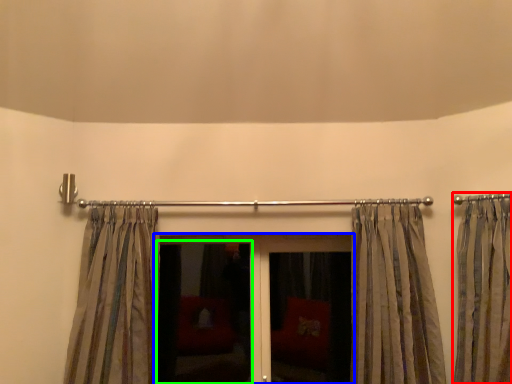
Question: Considering the real-world distances, which object is farthest from curtain (highlighted by a red box)? door (highlighted by a blue box) or screen door (highlighted by a green box)?

Choices:
 (A) door
 (B) screen door

Answer: (B)